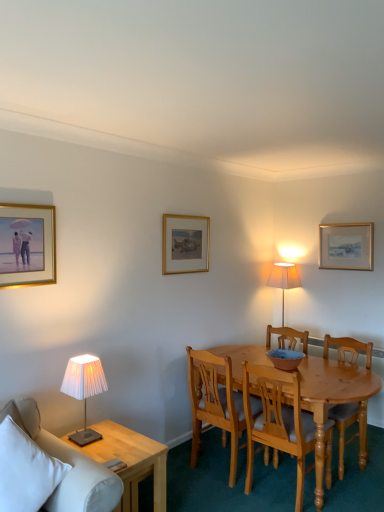
The width and height of the screenshot is (384, 512). I want to click on white pleated fabric lampshade at left, so click(84, 389).

Describe the element at coordinates (346, 246) in the screenshot. Image resolution: width=384 pixels, height=512 pixels. I see `gold-framed picture at upper right, the first picture frame in the back-to-front sequence` at that location.

What do you see at coordinates (344, 426) in the screenshot? I see `wooden chair at center, which is the 3th chair from left to right` at bounding box center [344, 426].

Identify the location of wooden chair at center, the first chair positioned from the right. (344, 426).

The image size is (384, 512). What do you see at coordinates (68, 463) in the screenshot? I see `white fabric couch at lower left` at bounding box center [68, 463].

I want to click on light brown wooden chair at center, the 3th chair positioned from the right, so click(215, 402).

Describe the element at coordinates (185, 244) in the screenshot. The image size is (384, 512). I see `gold/gilded picture frame at center, acting as the second picture frame starting from the front` at that location.

You are a GUI agent. You are given a task and a screenshot of the screen. Output one action in this format:
    pyautogui.click(x=<x>, y=<y>)
    Task: Click on the white pleated fabric lampshade at left
    This screenshot has width=384, height=512.
    Given the screenshot: What is the action you would take?
    pyautogui.click(x=84, y=389)

Are wooden chair at center, which is the 3th chair from left to right, and light wood side table at lower left located far from each other?

That's right, there is a large distance between wooden chair at center, which is the 3th chair from left to right, and light wood side table at lower left.

The width and height of the screenshot is (384, 512). Find the location of `the 2nd chair above when counting from the light wood side table at lower left (from the image's perspective)`. the 2nd chair above when counting from the light wood side table at lower left (from the image's perspective) is located at coordinates (344, 426).

From the image's perspective, is wooden chair at center, which is the 3th chair from left to right, above or below light wood side table at lower left?

Clearly, from the image's perspective, wooden chair at center, which is the 3th chair from left to right, is above light wood side table at lower left.

Is point (342, 460) closer or farther from the camera than point (110, 455)?

Clearly, point (342, 460) is more distant from the camera than point (110, 455).

How many degrees apart are the facing directions of matte blue bowl at center and gold-framed picture at upper right, acting as the third picture frame starting from the front?

90.7 degrees.

Between point (283, 361) and point (366, 242), which one is positioned in front?

Point (283, 361)

Who is taller, matte blue bowl at center or gold-framed picture at upper right, which ranks as the first picture frame in right-to-left order?

With more height is gold-framed picture at upper right, which ranks as the first picture frame in right-to-left order.

From the image's perspective, is matte blue bowl at center below gold-framed picture at upper right, acting as the third picture frame starting from the front?

Yes.

Can you tell me how much matte blue bowl at center and gold/gilded picture frame at center, the second picture frame when ordered from left to right, differ in facing direction?

0.279 degrees separate the facing orientations of matte blue bowl at center and gold/gilded picture frame at center, the second picture frame when ordered from left to right.

Does matte blue bowl at center have a lesser width compared to gold/gilded picture frame at center, the second picture frame in the back-to-front sequence?

In fact, matte blue bowl at center might be wider than gold/gilded picture frame at center, the second picture frame in the back-to-front sequence.

The height and width of the screenshot is (512, 384). I want to click on bowl below the gold/gilded picture frame at center, which is counted as the second picture frame, starting from the right (from the image's perspective), so click(285, 358).

From a real-world perspective, is matte blue bowl at center above or below gold/gilded picture frame at center, the second picture frame in the back-to-front sequence?

From a real-world perspective, matte blue bowl at center is physically below gold/gilded picture frame at center, the second picture frame in the back-to-front sequence.

Does gold-framed picture at upper right, which ranks as the first picture frame in right-to-left order, come behind white fabric couch at lower left?

Yes, gold-framed picture at upper right, which ranks as the first picture frame in right-to-left order, is further from the camera.

Is gold-framed picture at upper right, positioned as the 3th picture frame in left-to-right order, thinner than white fabric couch at lower left?

Yes, gold-framed picture at upper right, positioned as the 3th picture frame in left-to-right order, is thinner than white fabric couch at lower left.

You are a GUI agent. You are given a task and a screenshot of the screen. Output one action in this format:
    pyautogui.click(x=<x>, y=<y>)
    Task: Click on the studio couch located below the gold-framed picture at upper right, which ranks as the first picture frame in right-to-left order (from the image's perspective)
    The image size is (384, 512).
    Given the screenshot: What is the action you would take?
    pyautogui.click(x=68, y=463)

From the image's perspective, which one is positioned lower, gold-framed picture at upper right, the first picture frame in the back-to-front sequence, or white fabric couch at lower left?

white fabric couch at lower left is shown below in the image.

Can you see white pleated fabric lampshade at left touching gold-framed picture at upper right, the first picture frame in the back-to-front sequence?

No, white pleated fabric lampshade at left is not making contact with gold-framed picture at upper right, the first picture frame in the back-to-front sequence.

Considering the sizes of white pleated fabric lampshade at left and gold-framed picture at upper right, which ranks as the first picture frame in right-to-left order, in the image, is white pleated fabric lampshade at left bigger or smaller than gold-framed picture at upper right, which ranks as the first picture frame in right-to-left order,?

white pleated fabric lampshade at left is bigger than gold-framed picture at upper right, which ranks as the first picture frame in right-to-left order.

Considering the sizes of objects white pleated fabric lampshade at left and gold-framed picture at upper right, which ranks as the first picture frame in right-to-left order, in the image provided, who is thinner, white pleated fabric lampshade at left or gold-framed picture at upper right, which ranks as the first picture frame in right-to-left order,?

With smaller width is gold-framed picture at upper right, which ranks as the first picture frame in right-to-left order.

From the image's perspective, relative to gold-framed picture at upper right, positioned as the 3th picture frame in left-to-right order, is white pleated fabric lampshade at left above or below?

Based on their image positions, white pleated fabric lampshade at left is located beneath gold-framed picture at upper right, positioned as the 3th picture frame in left-to-right order.

Does light wood side table at lower left have a greater height compared to matte blue bowl at center?

Correct, light wood side table at lower left is much taller as matte blue bowl at center.

Which of these two, light wood side table at lower left or matte blue bowl at center, is wider?

With larger width is light wood side table at lower left.

Is point (127, 463) positioned after point (283, 357)?

No, (127, 463) is closer to viewer.

Consider the image. Is light wood side table at lower left in contact with matte blue bowl at center?

No, light wood side table at lower left is not with matte blue bowl at center.

Is point (3, 280) positioned behind point (284, 351)?

No, (3, 280) is closer to viewer.

Are gold-framed painting at upper left, the first picture frame from the front, and matte blue bowl at center located far from each other?

gold-framed painting at upper left, the first picture frame from the front, is positioned a significant distance from matte blue bowl at center.

What's the angular difference between gold-framed painting at upper left, which appears as the third picture frame when viewed from the back, and matte blue bowl at center's facing directions?

0.0984 degrees.

Does gold-framed painting at upper left, which is the third picture frame from right to left, contain matte blue bowl at center?

No, gold-framed painting at upper left, which is the third picture frame from right to left, does not contain matte blue bowl at center.

At what (x,y) coordinates should I click in order to perform the action: click on the 3rd chair behind the light wood side table at lower left. Please return your answer as a coordinate pair (x, y). Looking at the image, I should click on (344, 426).

Where is `bowl that appears below the gold-framed picture at upper right, which ranks as the first picture frame in right-to-left order (from a real-world perspective)`? The height and width of the screenshot is (512, 384). bowl that appears below the gold-framed picture at upper right, which ranks as the first picture frame in right-to-left order (from a real-world perspective) is located at coordinates (285, 358).

Based on their spatial positions, is white pleated fabric lampshade at left or gold-framed picture at upper right, acting as the third picture frame starting from the front, further from white fabric couch at lower left?

Among the two, gold-framed picture at upper right, acting as the third picture frame starting from the front, is located further to white fabric couch at lower left.

Which object lies nearer to the anchor point light brown wood chair at center, the second chair viewed from the right, white pleated fabric lampshade at left or gold-framed painting at upper left, which appears as the third picture frame when viewed from the back?

Among the two, white pleated fabric lampshade at left is located nearer to light brown wood chair at center, the second chair viewed from the right.

When comparing their distances from wooden chair at center, which is the 3th chair from left to right, does gold-framed picture at upper right, the first picture frame in the back-to-front sequence, or gold-framed painting at upper left, which is the third picture frame from right to left, seem closer?

gold-framed picture at upper right, the first picture frame in the back-to-front sequence, is positioned closer to the anchor wooden chair at center, which is the 3th chair from left to right.

Which object lies nearer to the anchor point white pleated fabric lampshade at left, white fabric couch at lower left or gold/gilded picture frame at center, which is counted as the second picture frame, starting from the right?

Among the two, white fabric couch at lower left is located nearer to white pleated fabric lampshade at left.

From the image, which object appears to be farther from light wood side table at lower left, matte blue bowl at center or gold/gilded picture frame at center, the second picture frame when ordered from left to right?

gold/gilded picture frame at center, the second picture frame when ordered from left to right.

Considering their positions, is light brown wooden chair at center, arranged as the first chair when viewed from the left, positioned further to white fabric couch at lower left than gold/gilded picture frame at center, the second picture frame when ordered from left to right?

gold/gilded picture frame at center, the second picture frame when ordered from left to right, is positioned further to the anchor white fabric couch at lower left.

When comparing their distances from matte blue bowl at center, does white fabric couch at lower left or light wood side table at lower left seem closer?

Among the two, light wood side table at lower left is located nearer to matte blue bowl at center.

Based on their spatial positions, is white fabric couch at lower left or light wood side table at lower left closer to light brown wood chair at center, arranged as the 2th chair when viewed from the left?

Based on the image, light wood side table at lower left appears to be nearer to light brown wood chair at center, arranged as the 2th chair when viewed from the left.

What are the coordinates of `studio couch between gold-framed painting at upper left, which is the third picture frame from right to left, and light wood side table at lower left from top to bottom` in the screenshot? It's located at (68, 463).

In order to click on lamp located between white fabric couch at lower left and gold-framed picture at upper right, acting as the third picture frame starting from the front, in the left-right direction in this screenshot , I will do `click(84, 389)`.

The image size is (384, 512). What are the coordinates of `bowl situated between white pleated fabric lampshade at left and gold-framed picture at upper right, the first picture frame in the back-to-front sequence, from left to right` in the screenshot? It's located at (285, 358).

You are a GUI agent. You are given a task and a screenshot of the screen. Output one action in this format:
    pyautogui.click(x=<x>, y=<y>)
    Task: Click on the lamp between gold-framed painting at upper left, the first picture frame from the front, and gold-framed picture at upper right, which ranks as the first picture frame in right-to-left order
    The width and height of the screenshot is (384, 512).
    Given the screenshot: What is the action you would take?
    pyautogui.click(x=84, y=389)